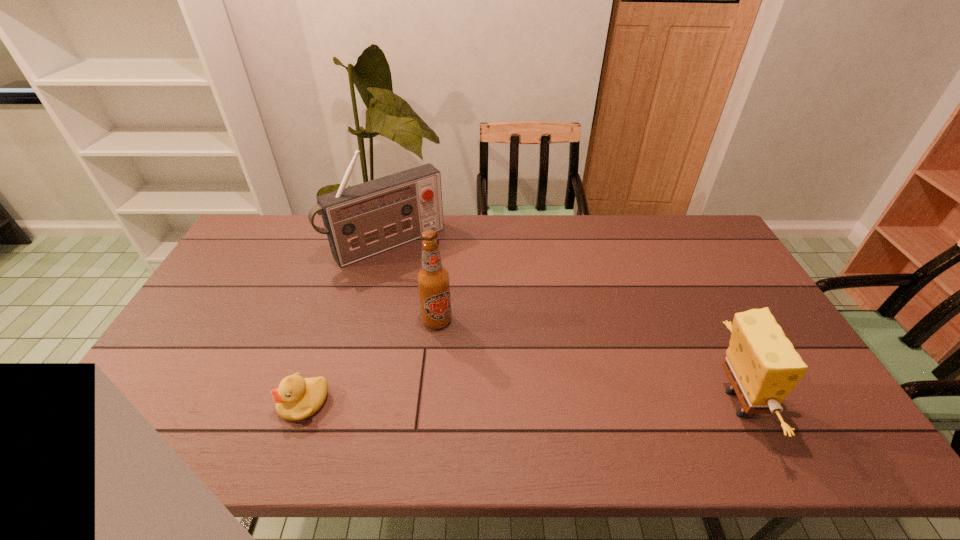
The height and width of the screenshot is (540, 960). Identify the location of free space that satisfies the following two spatial constraints: 1. on the front side of the third shortest object; 2. on the face of the sponge. (429, 403).